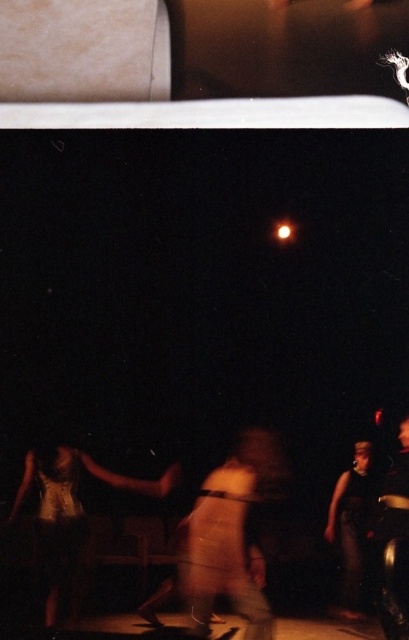
Does smooth beige pants at center appear on the left side of dark gray fabric at lower right?

Indeed, smooth beige pants at center is positioned on the left side of dark gray fabric at lower right.

Between smooth beige pants at center and dark gray fabric at lower right, which one has less height?

dark gray fabric at lower right

The image size is (409, 640). What do you see at coordinates (231, 536) in the screenshot?
I see `smooth beige pants at center` at bounding box center [231, 536].

The image size is (409, 640). I want to click on smooth beige pants at center, so click(231, 536).

Can you confirm if gold metallic dress at lower left is bigger than dark gray fabric at lower right?

Yes, gold metallic dress at lower left is bigger than dark gray fabric at lower right.

Is gold metallic dress at lower left to the left of dark gray fabric at lower right from the viewer's perspective?

Yes, gold metallic dress at lower left is to the left of dark gray fabric at lower right.

Describe the element at coordinates (71, 508) in the screenshot. I see `gold metallic dress at lower left` at that location.

Identify the location of gold metallic dress at lower left. (71, 508).

Between smooth beige pants at center and gold metallic dress at lower left, which one is positioned higher?

gold metallic dress at lower left is above.

Can you confirm if smooth beige pants at center is smaller than gold metallic dress at lower left?

Correct, smooth beige pants at center occupies less space than gold metallic dress at lower left.

Who is more distant from viewer, (x=224, y=544) or (x=177, y=481)?

Point (x=177, y=481)

Image resolution: width=409 pixels, height=640 pixels. In order to click on smooth beige pants at center in this screenshot , I will do `click(231, 536)`.